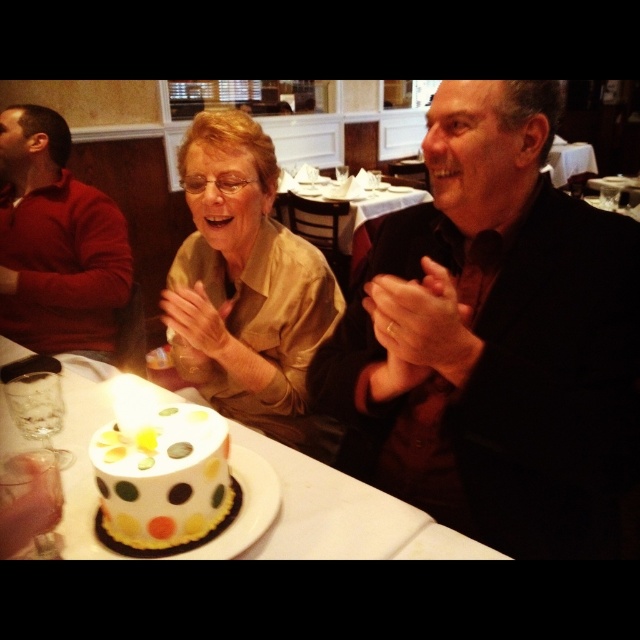
Question: Is matte gold blouse at center positioned in front of matte red sweater at left?

Choices:
 (A) yes
 (B) no

Answer: (A)

Question: Does matte gold blouse at center have a lesser width compared to white paper plate at center?

Choices:
 (A) no
 (B) yes

Answer: (B)

Question: Does matte black suit at center have a greater width compared to white polka dot cake at lower left?

Choices:
 (A) yes
 (B) no

Answer: (A)

Question: Which object is the farthest from the matte red sweater at left?

Choices:
 (A) white paper plate at center
 (B) matte black suit at center
 (C) white polka dot cake at lower left

Answer: (B)

Question: Which of the following is the farthest from the observer?

Choices:
 (A) (211, 314)
 (B) (208, 484)

Answer: (A)

Question: Among these objects, which one is farthest from the camera?

Choices:
 (A) matte black suit at center
 (B) white paper plate at center

Answer: (B)